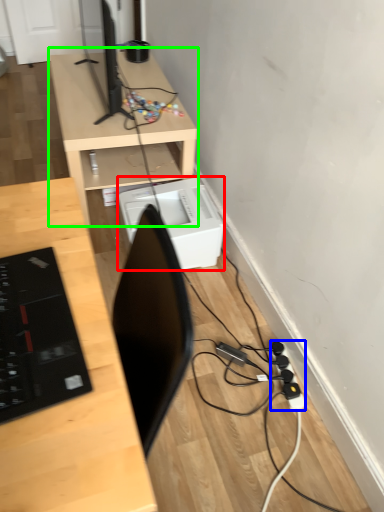
Question: Which is farther away from printer (highlighted by a red box)? extension cord (highlighted by a blue box) or desk (highlighted by a green box)?

Choices:
 (A) extension cord
 (B) desk

Answer: (A)